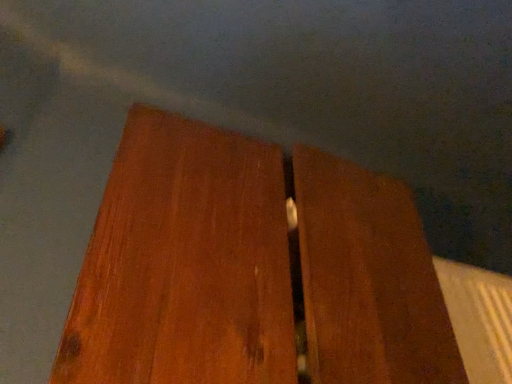
The width and height of the screenshot is (512, 384). Find the location of `satin wood door at center`. satin wood door at center is located at coordinates (184, 264).

This screenshot has width=512, height=384. What do you see at coordinates (184, 264) in the screenshot? I see `satin wood door at center` at bounding box center [184, 264].

Identify the location of satin wood door at center. (184, 264).